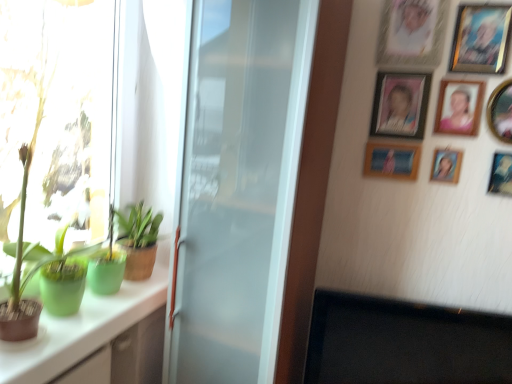
Question: Is green matte plant at left, acting as the 1th houseplant starting from the top, surrounding green matte plant at left, positioned as the second houseplant in bottom-to-top order?

Choices:
 (A) yes
 (B) no

Answer: (B)

Question: Does green matte plant at left, acting as the third houseplant starting from the bottom, have a lesser height compared to green matte plant at left, positioned as the second houseplant in bottom-to-top order?

Choices:
 (A) yes
 (B) no

Answer: (B)

Question: Is green matte plant at left, acting as the 1th houseplant starting from the top, next to green matte plant at left, the 2th houseplant when ordered from top to bottom, and touching it?

Choices:
 (A) yes
 (B) no

Answer: (B)

Question: Can you confirm if green matte plant at left, acting as the third houseplant starting from the bottom, is thinner than green matte plant at left, positioned as the second houseplant in bottom-to-top order?

Choices:
 (A) yes
 (B) no

Answer: (A)

Question: Is green matte plant at left, acting as the third houseplant starting from the bottom, looking in the opposite direction of green matte plant at left, positioned as the second houseplant in bottom-to-top order?

Choices:
 (A) yes
 (B) no

Answer: (A)

Question: Can you confirm if green matte plant at left, acting as the third houseplant starting from the bottom, is wider than green matte plant at left, the 2th houseplant when ordered from top to bottom?

Choices:
 (A) no
 (B) yes

Answer: (A)

Question: Does matte plastic picture frame at upper right, the 5th picture frame in the bottom-to-top sequence, have a smaller size compared to satin white refrigerator at center?

Choices:
 (A) no
 (B) yes

Answer: (B)

Question: Does matte plastic picture frame at upper right, the 5th picture frame in the bottom-to-top sequence, have a larger size compared to satin white refrigerator at center?

Choices:
 (A) yes
 (B) no

Answer: (B)

Question: Is the surface of matte plastic picture frame at upper right, the 5th picture frame in the bottom-to-top sequence, in direct contact with satin white refrigerator at center?

Choices:
 (A) yes
 (B) no

Answer: (B)

Question: Is matte plastic picture frame at upper right, the 5th picture frame in the bottom-to-top sequence, at the right side of satin white refrigerator at center?

Choices:
 (A) no
 (B) yes

Answer: (B)

Question: Are matte plastic picture frame at upper right, the 4th picture frame viewed from the top, and satin white refrigerator at center located far from each other?

Choices:
 (A) no
 (B) yes

Answer: (A)

Question: Is matte plastic picture frame at upper right, the 4th picture frame viewed from the top, not within satin white refrigerator at center?

Choices:
 (A) no
 (B) yes

Answer: (B)

Question: Does wooden picture frame at upper right, which is counted as the 2th picture frame, starting from the top, have a larger size compared to wooden photo frame at upper right, the 3th picture frame when ordered from top to bottom?

Choices:
 (A) no
 (B) yes

Answer: (A)